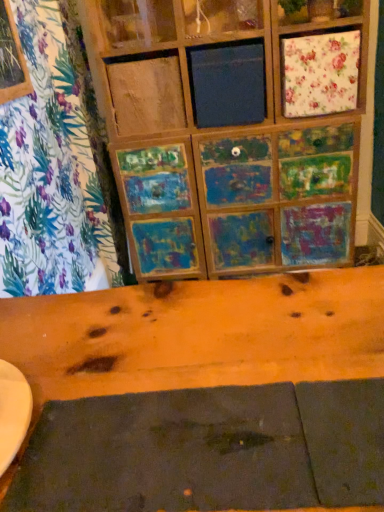
The width and height of the screenshot is (384, 512). Find the location of `empty space that is ontop of dark matte placemat at lower center (from a real-world perspective)`. empty space that is ontop of dark matte placemat at lower center (from a real-world perspective) is located at coordinates (188, 447).